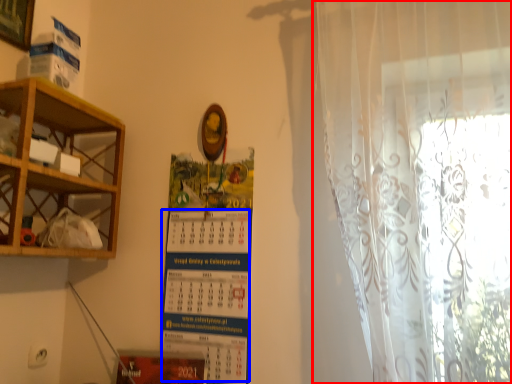
Question: Which of the following is the farthest to the observer, curtain (highlighted by a red box) or writing (highlighted by a blue box)?

Choices:
 (A) curtain
 (B) writing

Answer: (B)